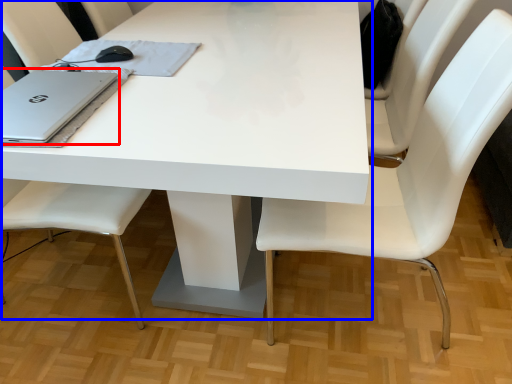
Question: Among these objects, which one is farthest to the camera, laptop (highlighted by a red box) or table (highlighted by a blue box)?

Choices:
 (A) laptop
 (B) table

Answer: (A)